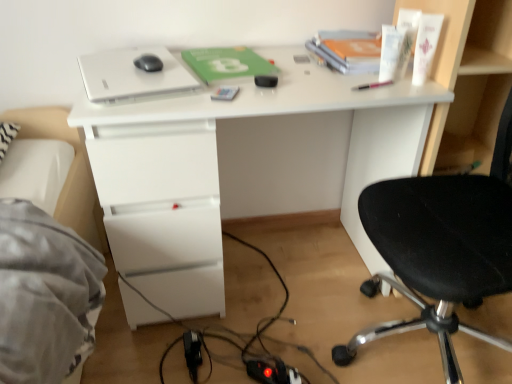
At what (x,y) coordinates should I click in order to perform the action: click on free point in front of green matte paperback book at center. Please return your answer as a coordinate pair (x, y). Looking at the image, I should click on click(239, 96).